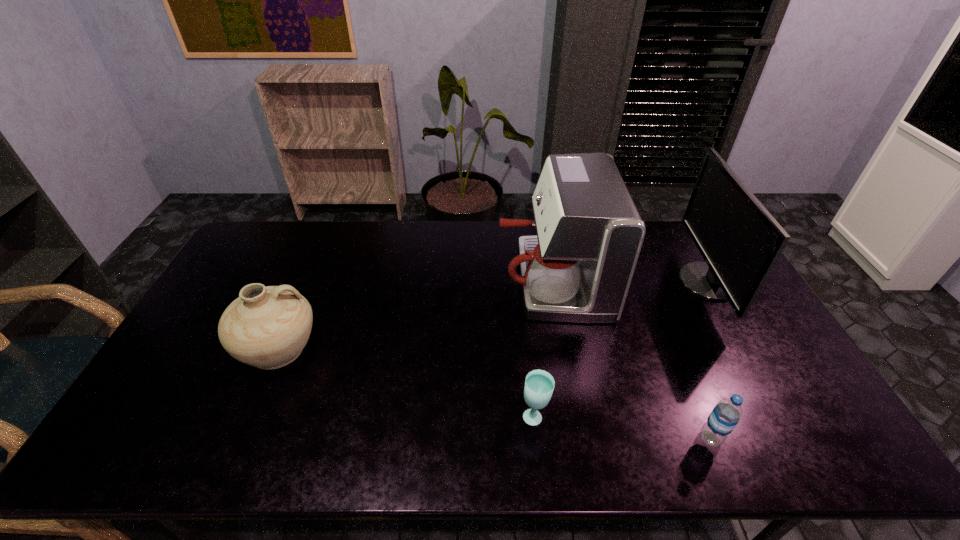
This screenshot has width=960, height=540. Identify the location of monitor that is at the far edge. (740, 241).

The height and width of the screenshot is (540, 960). What are the coordinates of `object that is at the near edge` in the screenshot? It's located at (726, 414).

Where is `object that is at the right edge`? This screenshot has height=540, width=960. object that is at the right edge is located at coordinates (740, 241).

You are a GUI agent. You are given a task and a screenshot of the screen. Output one action in this format:
    pyautogui.click(x=<x>, y=<y>)
    Task: Click on the object present at the far right corner
    The height and width of the screenshot is (540, 960).
    Given the screenshot: What is the action you would take?
    pyautogui.click(x=740, y=241)

Locate an element on the screen. Image resolution: width=960 pixels, height=540 pixels. vacant space at the far edge of the desktop is located at coordinates (343, 245).

Locate an element on the screen. vacant space at the near edge of the desktop is located at coordinates (476, 447).

Find the location of a particular element. The width and height of the screenshot is (960, 540). vacant space at the right edge is located at coordinates (729, 303).

The height and width of the screenshot is (540, 960). In order to click on vacant point located between the rightmost object and the nearest object in this screenshot , I will do `click(709, 360)`.

Find the location of a particular element. This screenshot has height=540, width=960. free spot between the third shortest object and the second object from right to left is located at coordinates (494, 393).

Locate an element on the screen. The width and height of the screenshot is (960, 540). free space that is in between the second object from right to left and the coffee maker is located at coordinates (631, 359).